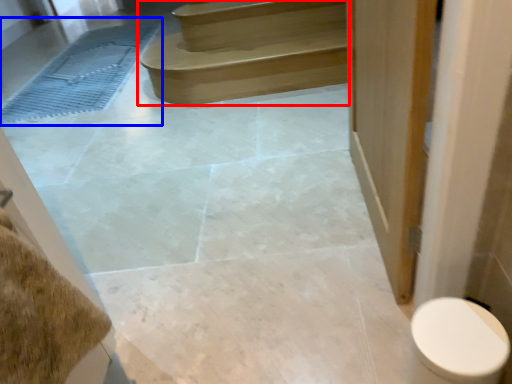
Question: Which of the following is the farthest to the observer, stairs (highlighted by a red box) or bath mat (highlighted by a blue box)?

Choices:
 (A) stairs
 (B) bath mat

Answer: (B)